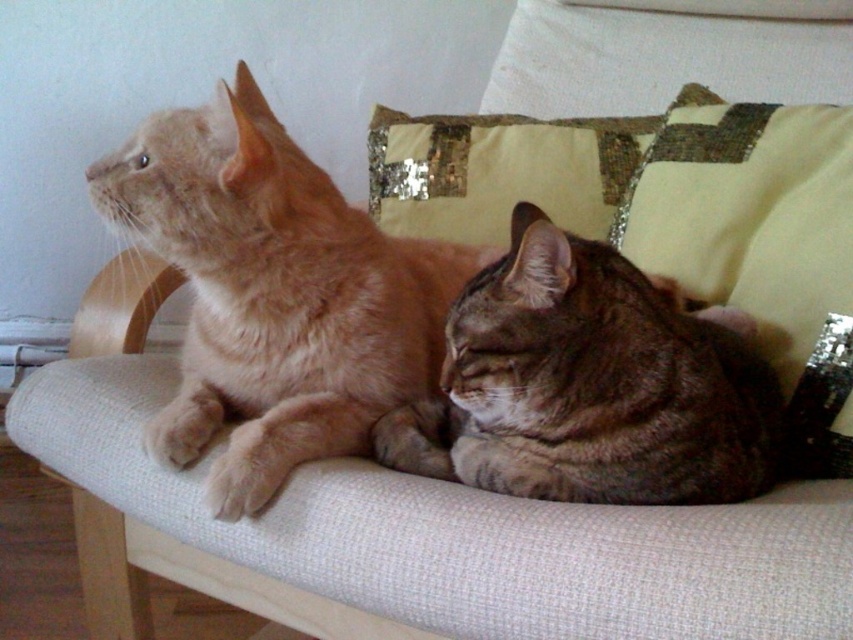
Question: Which point is closer to the camera?

Choices:
 (A) tabby fur cat at center
 (B) light brown fur cat at left

Answer: (A)

Question: Does light brown fur cat at left have a smaller size compared to tabby fur cat at center?

Choices:
 (A) yes
 (B) no

Answer: (B)

Question: Is light brown fur cat at left wider than tabby fur cat at center?

Choices:
 (A) no
 (B) yes

Answer: (B)

Question: Which point is closer to the camera taking this photo?

Choices:
 (A) (306, 228)
 (B) (509, 326)

Answer: (B)

Question: Is light brown fur cat at left to the right of tabby fur cat at center from the viewer's perspective?

Choices:
 (A) yes
 (B) no

Answer: (B)